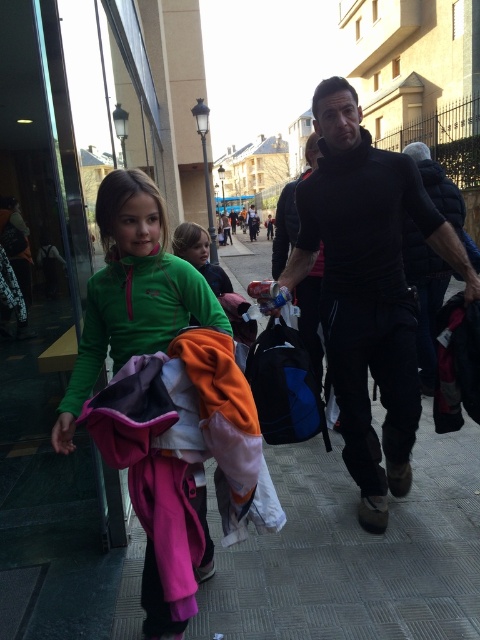
In the scene shown: You are a store employee organizing jackets in a store. You have to place the black quilted vest at center and the green fleece jacket at center on a rack. According to the image, which jacket should you place higher on the rack?

The black quilted vest at center is taller than the green fleece jacket at center, so you should place the black quilted vest at center higher on the rack to accommodate its height.

What is the object located at the coordinates point (355, 552) in the image?

The object located at the coordinates point (355, 552) is the gray concrete pavement at center.